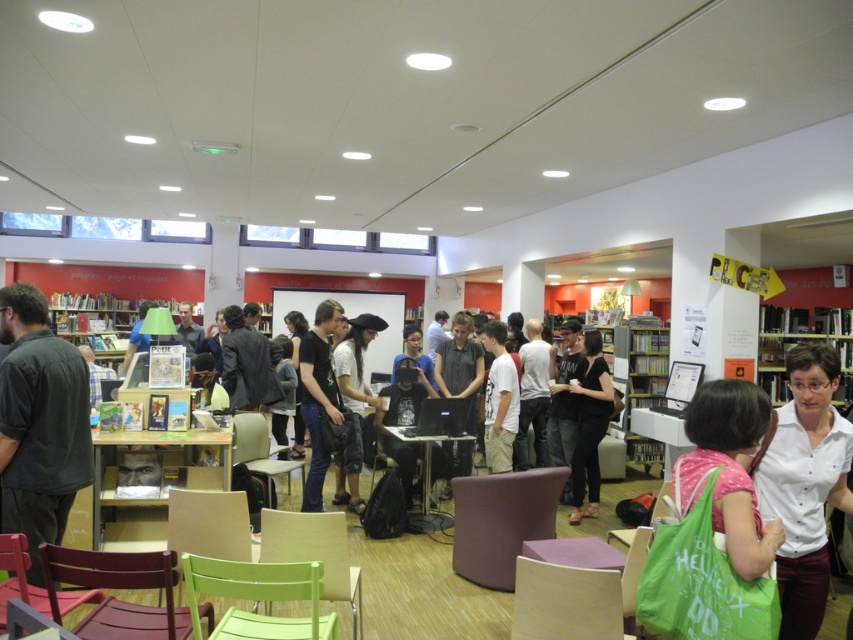
Question: Estimate the real-world distances between objects in this image. Which object is farther from the pink fabric bag at lower right?

Choices:
 (A) white cotton shirt at center
 (B) black matte hat at center

Answer: (B)

Question: Which of the following is the farthest from the observer?

Choices:
 (A) (747, 467)
 (B) (599, 353)
 (C) (3, 433)
 (D) (318, 486)

Answer: (B)

Question: Is white matte shirt at center to the left of black matte shirt at center from the viewer's perspective?

Choices:
 (A) yes
 (B) no

Answer: (A)

Question: Observing the image, what is the correct spatial positioning of dark gray shirt at left in reference to white matte shirt at center?

Choices:
 (A) right
 (B) left

Answer: (B)

Question: Does pink fabric bag at lower right have a smaller size compared to black cotton t-shirt at center?

Choices:
 (A) no
 (B) yes

Answer: (B)

Question: Which point is farther to the camera?

Choices:
 (A) (587, 502)
 (B) (352, 429)
 (C) (515, 433)

Answer: (A)